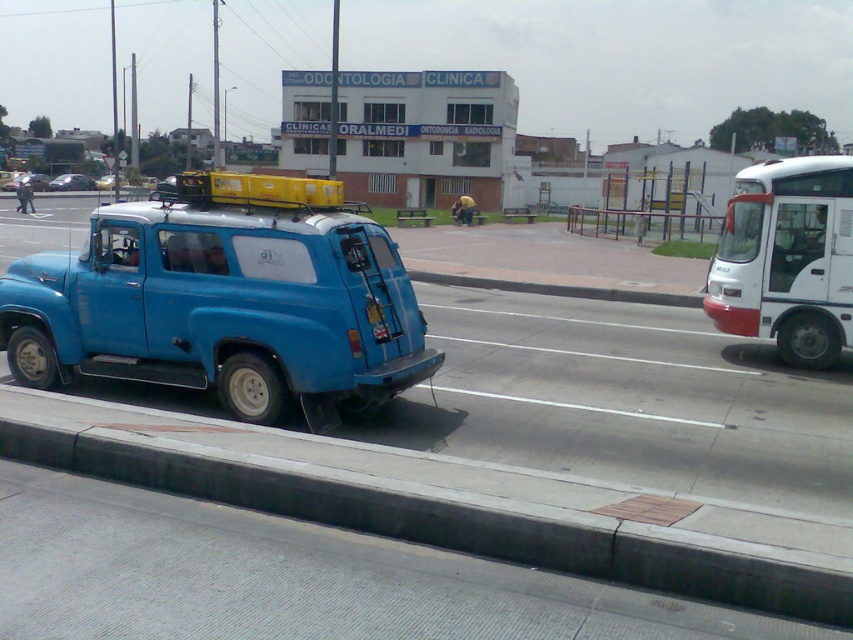
Question: Does gray concrete curb at lower left appear on the right side of white glossy bus at right?

Choices:
 (A) yes
 (B) no

Answer: (B)

Question: Can you confirm if white glossy bus at right is positioned to the right of blue matte van at center?

Choices:
 (A) no
 (B) yes

Answer: (B)

Question: Among these points, which one is nearest to the camera?

Choices:
 (A) (71, 188)
 (B) (102, 186)
 (C) (781, 168)

Answer: (C)

Question: Which point appears closest to the camera in this image?

Choices:
 (A) [x=244, y=301]
 (B) [x=74, y=188]
 (C) [x=712, y=272]

Answer: (A)

Question: Considering the relative positions of matte blue van at left and blue matte van at center in the image provided, where is matte blue van at left located with respect to blue matte van at center?

Choices:
 (A) right
 (B) left

Answer: (A)

Question: Considering the real-world distances, which object is closest to the blue matte van at center?

Choices:
 (A) white glossy bus at right
 (B) metallic blue van at center
 (C) gray concrete curb at lower left

Answer: (B)